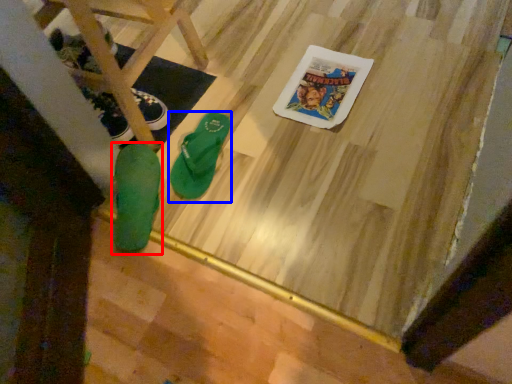
Question: Which point is further to the camera, footwear (highlighted by a red box) or footwear (highlighted by a blue box)?

Choices:
 (A) footwear
 (B) footwear

Answer: (B)